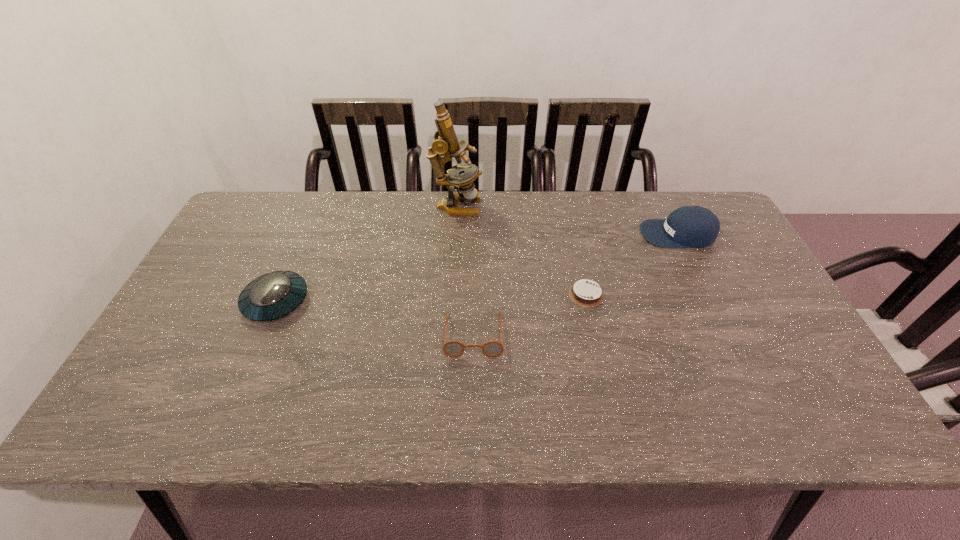
You are a GUI agent. You are given a task and a screenshot of the screen. Output one action in this format:
    pyautogui.click(x=<x>, y=<y>)
    Task: Click on the empty location between the tallest object and the baseball cap
    This screenshot has height=540, width=960.
    Given the screenshot: What is the action you would take?
    pyautogui.click(x=567, y=220)

Locate an element on the screen. This screenshot has width=960, height=540. free space between the leftmost object and the fourth nearest object is located at coordinates (477, 267).

Locate which object ranks fourth in proximity to the saucer. Please provide its 2D coordinates. Your answer should be formatted as a tuple, i.e. [(x, y)], where the tuple contains the x and y coordinates of a point satisfying the conditions above.

[(689, 226)]

The width and height of the screenshot is (960, 540). In order to click on object that is the second closest one to the leftmost object in this screenshot , I will do `click(446, 142)`.

At what (x,y) coordinates should I click in order to perform the action: click on free location that satisfies the following two spatial constraints: 1. on the front side of the farthest object; 2. on the left side of the shortest object. Please return your answer as a coordinate pair (x, y). Looking at the image, I should click on (451, 294).

This screenshot has height=540, width=960. Identify the location of vacant space that satisfies the following two spatial constraints: 1. on the front-facing side of the fourth nearest object; 2. on the front-facing side of the spectacles. (726, 334).

Where is `vacant space that satisfies the following two spatial constraints: 1. on the front-facing side of the fourth nearest object; 2. on the front-facing side of the spectacles`? This screenshot has height=540, width=960. vacant space that satisfies the following two spatial constraints: 1. on the front-facing side of the fourth nearest object; 2. on the front-facing side of the spectacles is located at coordinates (726, 334).